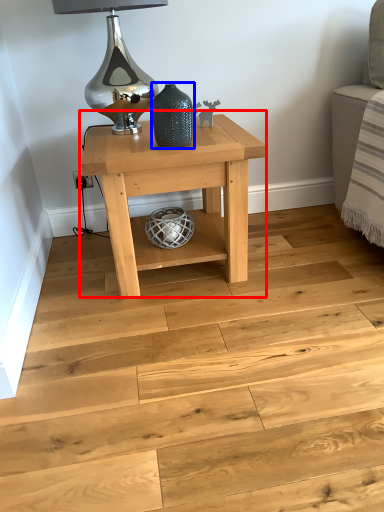
Question: Which object appears closest to the camera in this image, table (highlighted by a red box) or vase (highlighted by a blue box)?

Choices:
 (A) table
 (B) vase

Answer: (B)